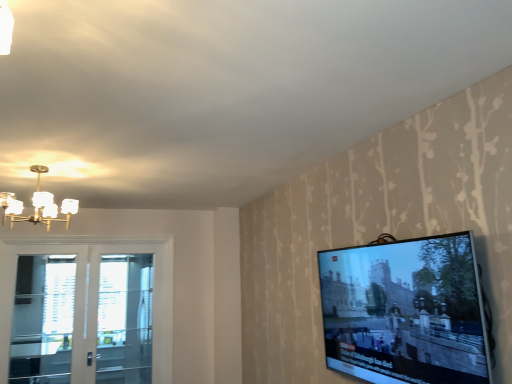
Question: Does matte glass chandelier at upper left have a lesser height compared to white glass door at left?

Choices:
 (A) yes
 (B) no

Answer: (A)

Question: Considering the relative positions of matte glass chandelier at upper left and white glass door at left in the image provided, is matte glass chandelier at upper left to the left of white glass door at left from the viewer's perspective?

Choices:
 (A) yes
 (B) no

Answer: (B)

Question: Does matte glass chandelier at upper left have a greater height compared to white glass door at left?

Choices:
 (A) yes
 (B) no

Answer: (B)

Question: Considering the relative sizes of matte glass chandelier at upper left and white glass door at left in the image provided, is matte glass chandelier at upper left bigger than white glass door at left?

Choices:
 (A) no
 (B) yes

Answer: (A)

Question: From a real-world perspective, does matte glass chandelier at upper left sit lower than white glass door at left?

Choices:
 (A) yes
 (B) no

Answer: (B)

Question: From their relative heights in the image, would you say matte glass chandelier at upper left is taller or shorter than white glass door at left?

Choices:
 (A) tall
 (B) short

Answer: (B)

Question: Is matte glass chandelier at upper left situated inside white glass door at left or outside?

Choices:
 (A) inside
 (B) outside

Answer: (B)

Question: Is matte glass chandelier at upper left in front of or behind white glass door at left in the image?

Choices:
 (A) front
 (B) behind

Answer: (A)

Question: Is matte glass chandelier at upper left wider or thinner than white glass door at left?

Choices:
 (A) thin
 (B) wide

Answer: (B)

Question: Is clear glass door at left, acting as the 2th screen door starting from the left, taller or shorter than matte glass chandelier at upper left?

Choices:
 (A) tall
 (B) short

Answer: (A)

Question: From a real-world perspective, is clear glass door at left, acting as the 2th screen door starting from the left, physically located above or below matte glass chandelier at upper left?

Choices:
 (A) above
 (B) below

Answer: (B)

Question: Relative to matte glass chandelier at upper left, is clear glass door at left, the first screen door positioned from the right, in front or behind?

Choices:
 (A) front
 (B) behind

Answer: (B)

Question: Choose the correct answer: Is clear glass door at left, acting as the 2th screen door starting from the left, inside matte glass chandelier at upper left or outside it?

Choices:
 (A) outside
 (B) inside

Answer: (A)

Question: Considering the positions of white glass door at left and clear glass screen door at left, the 1th screen door from the left, in the image, is white glass door at left taller or shorter than clear glass screen door at left, the 1th screen door from the left,?

Choices:
 (A) tall
 (B) short

Answer: (A)

Question: Considering their positions, is white glass door at left located in front of or behind clear glass screen door at left, the 1th screen door from the left?

Choices:
 (A) behind
 (B) front

Answer: (B)